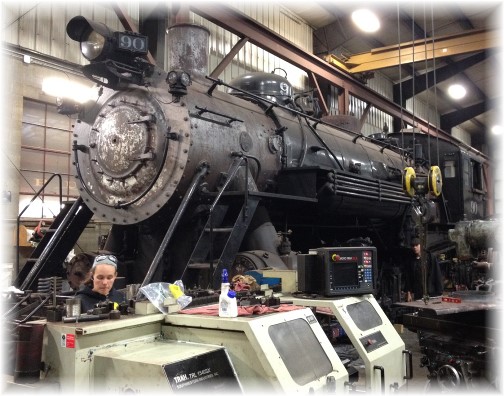
Locate an element on the screen. windows is located at coordinates (310, 364).